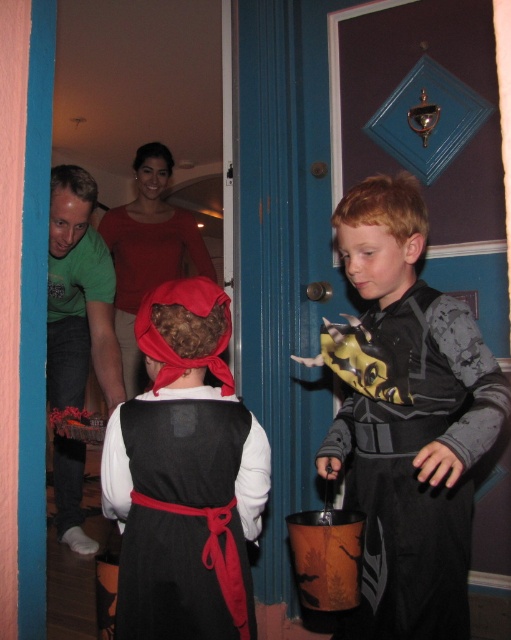
You are a photographer at the Halloween event and need to arrange the black matte costume at center and the velvet black dress at center in a photo so that both are visible. Given that they are both at the center, how should you position them to ensure both are fully visible?

Since the black matte costume at center is taller than the velvet black dress at center, you should position the taller black matte costume at center behind the shorter velvet black dress at center so that both are fully visible in the photo.